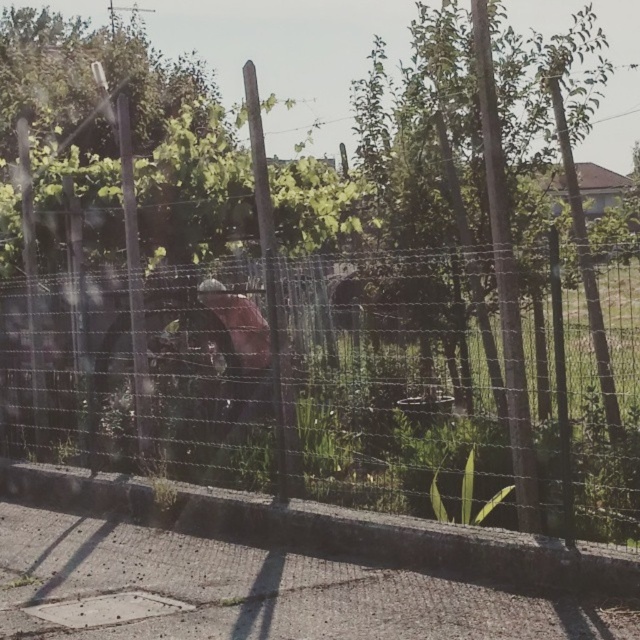
What do you see at coordinates (461, 394) in the screenshot? I see `wire mesh fence at center` at bounding box center [461, 394].

Can you confirm if wire mesh fence at center is shorter than green leafy tree at center?

Correct, wire mesh fence at center is not as tall as green leafy tree at center.

Where is `wire mesh fence at center`? The image size is (640, 640). wire mesh fence at center is located at coordinates (461, 394).

The width and height of the screenshot is (640, 640). I want to click on wire mesh fence at center, so click(x=461, y=394).